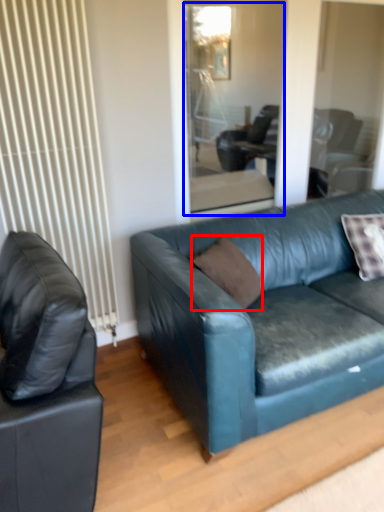
Question: Among these objects, which one is farthest to the camera, pillow (highlighted by a red box) or glass door (highlighted by a blue box)?

Choices:
 (A) pillow
 (B) glass door

Answer: (B)